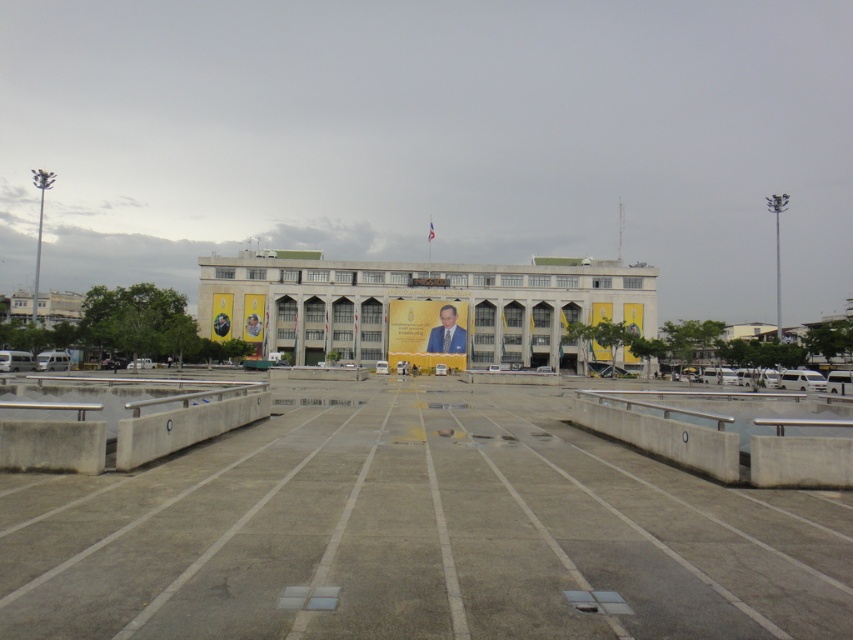
You are standing at the entrance of the plaza and want to walk towards the building. There is concrete at center and formal suit at center in your path. Which object will you step on first?

The concrete at center is wider than the formal suit at center, so you will step on the concrete at center first.

You are planning to place a 2m by 2m temporary stage in the plaza. The stage requires a flat, unobstructed area larger than its size. Given the presence of the concrete at center and formal suit at center, which location would be suitable for placing the stage?

The concrete at center is bigger than the formal suit at center, so the concrete at center would be suitable for placing the 2m by 2m temporary stage as it provides a larger and unobstructed area.